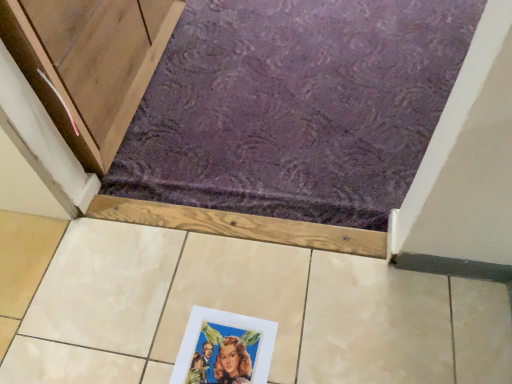
Locate an element on the screen. The width and height of the screenshot is (512, 384). vacant space underneath matte paper picture frame at lower center (from a real-world perspective) is located at coordinates (219, 355).